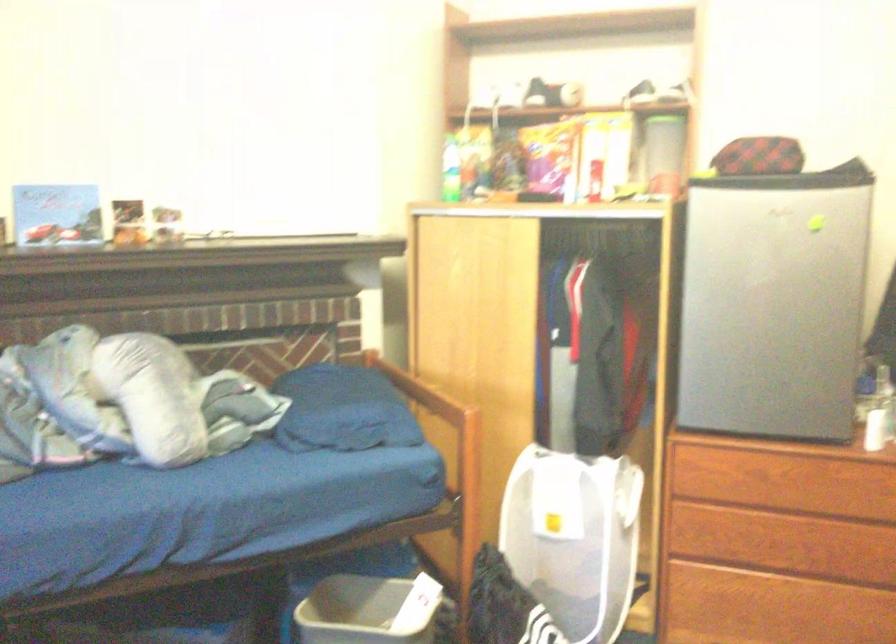
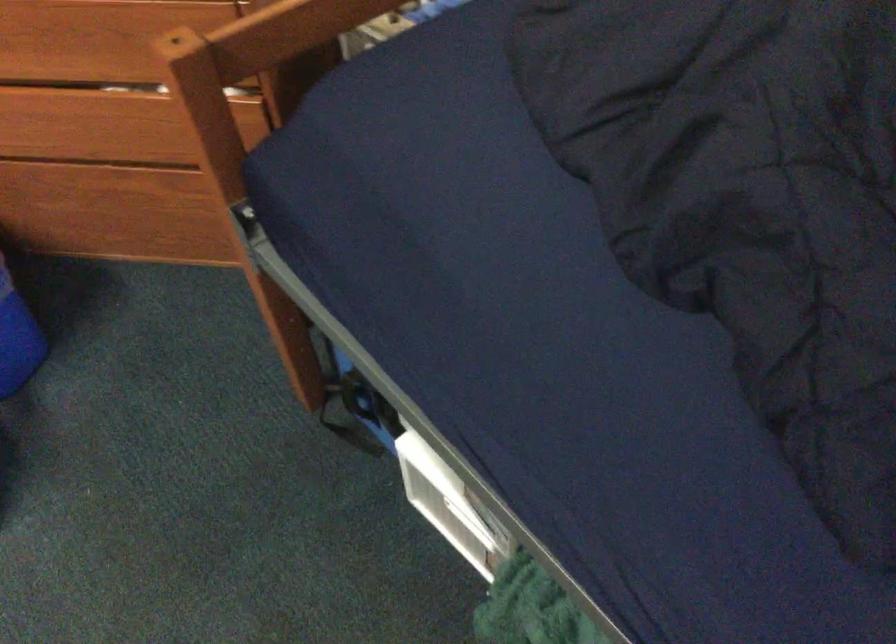
First-person continuous shooting, in which direction is the camera rotating?

The camera's rotation is toward right-down.